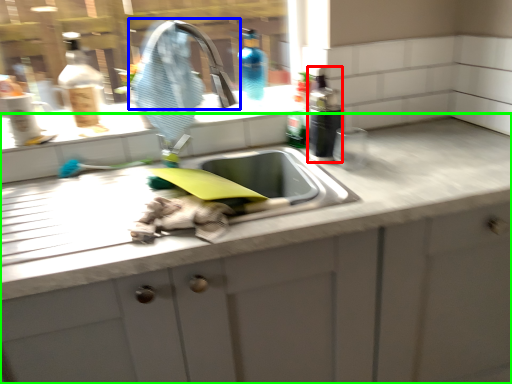
Question: Considering the real-world distances, which object is farthest from bottle (highlighted by a red box)? tap (highlighted by a blue box) or countertop (highlighted by a green box)?

Choices:
 (A) tap
 (B) countertop

Answer: (B)